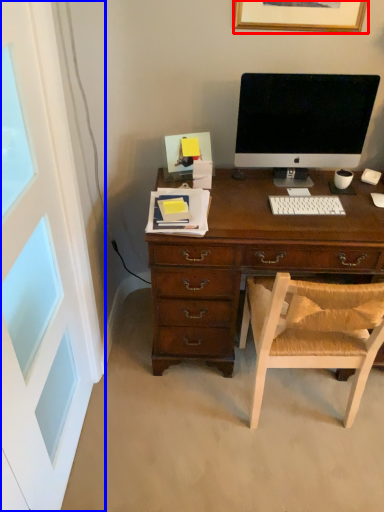
Question: Which object appears farthest to the camera in this image, picture frame (highlighted by a red box) or screen door (highlighted by a blue box)?

Choices:
 (A) picture frame
 (B) screen door

Answer: (A)